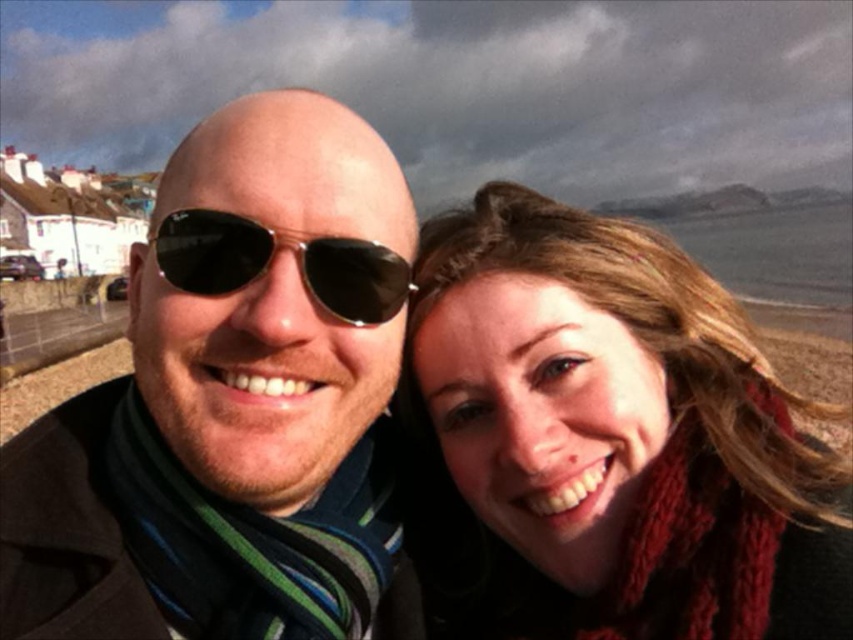
Question: Does matte black sunglasses at center appear on the right side of black reflective sunglasses at center?

Choices:
 (A) yes
 (B) no

Answer: (B)

Question: Estimate the real-world distances between objects in this image. Which object is closer to the knitted red scarf at right?

Choices:
 (A) matte black sunglasses at center
 (B) black reflective sunglasses at center

Answer: (A)

Question: Which point is farther from the camera taking this photo?

Choices:
 (A) (328, 266)
 (B) (306, 611)

Answer: (A)

Question: Is knitted red scarf at right closer to the viewer compared to black reflective sunglasses at center?

Choices:
 (A) yes
 (B) no

Answer: (A)

Question: Which object is closer to the camera taking this photo?

Choices:
 (A) matte black sunglasses at center
 (B) black reflective sunglasses at center

Answer: (A)

Question: Can you confirm if matte black sunglasses at center is smaller than black reflective sunglasses at center?

Choices:
 (A) yes
 (B) no

Answer: (B)